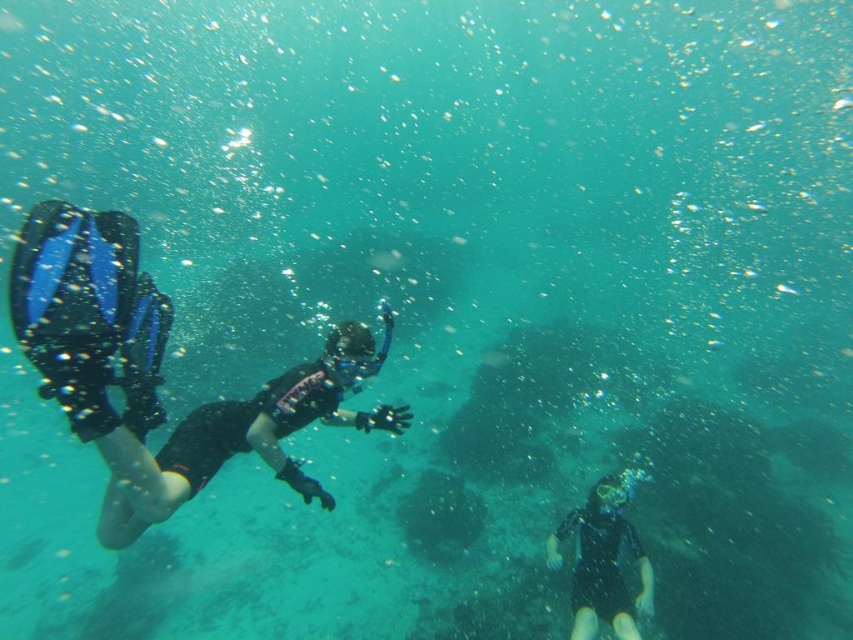
You are a marine biologist studying the underwater environment. You notice two divers in the scene. One is at the position marked by point (242, 435). What is the color of the wetsuit worn by the diver at this point?

The black matte wetsuit at left is located at point (242, 435), so the diver there is wearing a black matte wetsuit.

You are a marine biologist observing two divers underwater. You notice the black matte wetsuit at left and the black matte wetsuit at lower right. Which diver is positioned higher in the water column?

The black matte wetsuit at left is taller than the black matte wetsuit at lower right, so the diver in the black matte wetsuit at left is positioned higher in the water column.

You are a marine biologist observing two divers underwater. You notice the black matte wetsuit at left and the black matte wetsuit at lower right. Which diver is wearing a larger wetsuit?

The black matte wetsuit at left has a larger size compared to the black matte wetsuit at lower right, so the diver wearing the black matte wetsuit at left has the larger one.